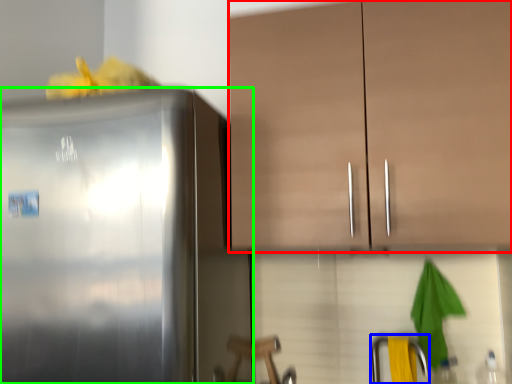
Question: Which is farther away from cabinetry (highlighted by a red box)? faucet (highlighted by a blue box) or refrigerator (highlighted by a green box)?

Choices:
 (A) faucet
 (B) refrigerator

Answer: (A)